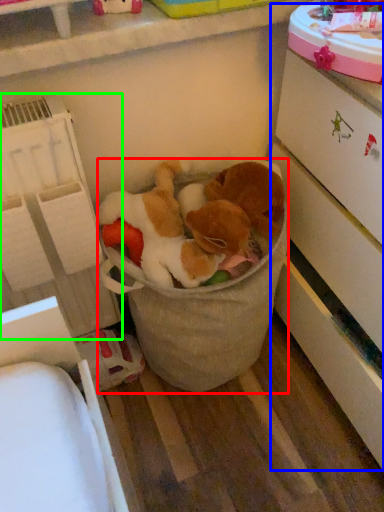
Question: Considering the real-world distances, which object is farthest from toy (highlighted by a red box)? cabinetry (highlighted by a blue box) or shelf (highlighted by a green box)?

Choices:
 (A) cabinetry
 (B) shelf

Answer: (A)